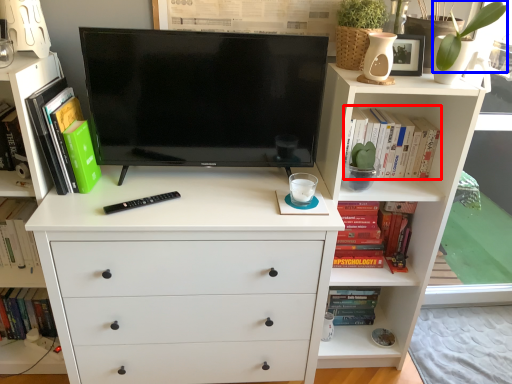
Question: Which object is closer to the camera taking this photo, book (highlighted by a red box) or plant (highlighted by a blue box)?

Choices:
 (A) book
 (B) plant

Answer: (B)